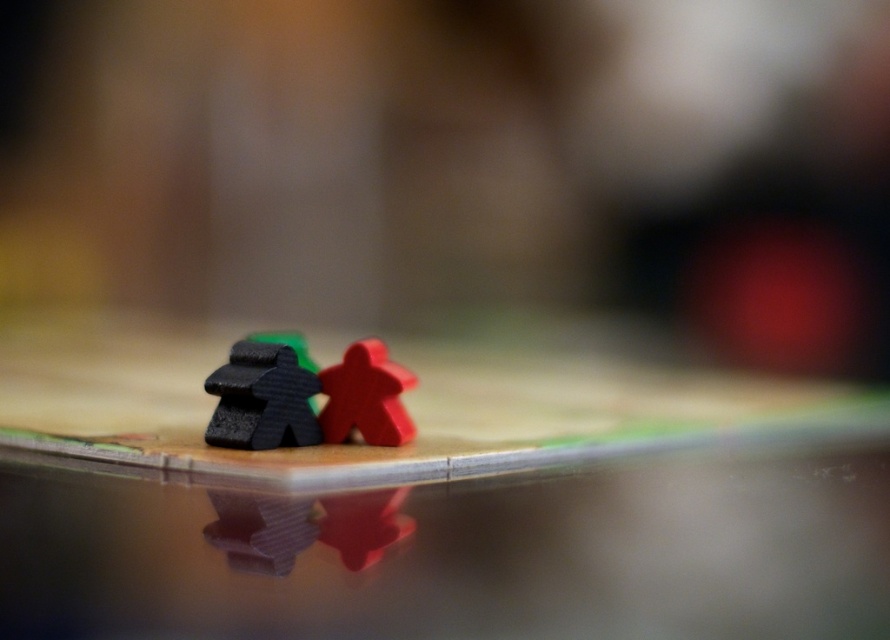
Does point (223, 435) lie behind point (356, 371)?

No.

Between matte black meeples at center and matte plastic meeples at center, which one is positioned lower?

matte black meeples at center is lower down.

Image resolution: width=890 pixels, height=640 pixels. Find the location of `matte black meeples at center`. matte black meeples at center is located at coordinates (263, 397).

Between point (280, 512) and point (240, 400), which one is positioned behind?

The point (240, 400) is behind.

Locate an element on the screen. matte red meeple at lower center is located at coordinates (305, 529).

Which is in front, point (338, 502) or point (282, 381)?

Point (338, 502) is in front.

Find the location of a particular element. This screenshot has width=890, height=640. matte red meeple at lower center is located at coordinates (305, 529).

Is wooden board game pieces at center positioned at the back of matte red meeple at lower center?

No, it is in front of matte red meeple at lower center.

Is wooden board game pieces at center closer to camera compared to matte red meeple at lower center?

That is True.

I want to click on wooden board game pieces at center, so click(x=443, y=508).

Locate an element on the screen. This screenshot has height=640, width=890. wooden board game pieces at center is located at coordinates (443, 508).